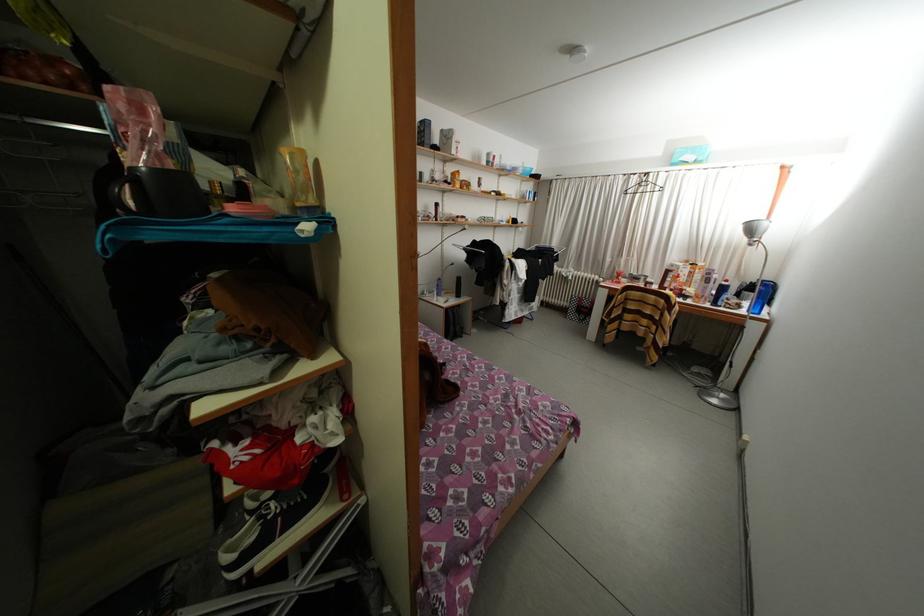
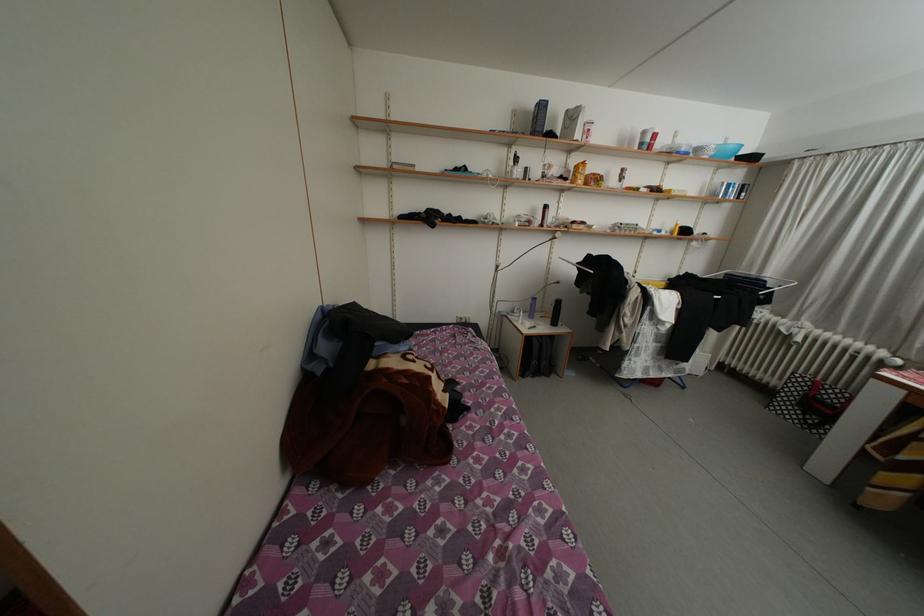
Where in the second image is the point corresponding to pixel 460 180 from the first image?

(584, 172)